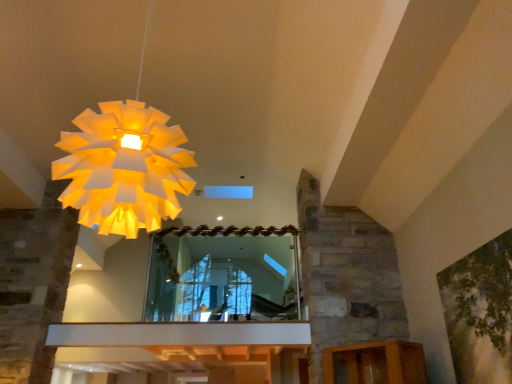
Identify the location of green leafy tree at upper right. Image resolution: width=512 pixels, height=384 pixels. (483, 291).

Where is `white paper lampshade at upper left`? This screenshot has width=512, height=384. white paper lampshade at upper left is located at coordinates tap(124, 165).

At what (x,y) coordinates should I click in order to perform the action: click on clear glass mirror at center. Please return your answer as a coordinate pair (x, y). This screenshot has height=384, width=512. Looking at the image, I should click on (223, 274).

Considering the sizes of white paper lampshade at upper left and clear glass mirror at center in the image, is white paper lampshade at upper left taller or shorter than clear glass mirror at center?

Clearly, white paper lampshade at upper left is taller compared to clear glass mirror at center.

Is white paper lampshade at upper left not near clear glass mirror at center?

Yes, white paper lampshade at upper left and clear glass mirror at center are quite far apart.

Can you tell me how much white paper lampshade at upper left and clear glass mirror at center differ in facing direction?

The facing directions of white paper lampshade at upper left and clear glass mirror at center are 0.0343 degrees apart.

From the image's perspective, does white paper lampshade at upper left appear lower than clear glass mirror at center?

Incorrect, from the image's perspective, white paper lampshade at upper left is higher than clear glass mirror at center.

Between green leafy tree at upper right and white paper lampshade at upper left, which one has larger width?

white paper lampshade at upper left is wider.

Can you confirm if green leafy tree at upper right is positioned to the left of white paper lampshade at upper left?

Incorrect, green leafy tree at upper right is not on the left side of white paper lampshade at upper left.

Could you tell me if green leafy tree at upper right is turned towards white paper lampshade at upper left?

No, green leafy tree at upper right does not turn towards white paper lampshade at upper left.

From a real-world perspective, does green leafy tree at upper right sit lower than white paper lampshade at upper left?

Yes, from a real-world perspective, green leafy tree at upper right is below white paper lampshade at upper left.

Does clear glass mirror at center lie in front of green leafy tree at upper right?

No.

How far apart are clear glass mirror at center and green leafy tree at upper right?

clear glass mirror at center is 2.79 meters from green leafy tree at upper right.

Find the location of a particular element. Image resolution: width=512 pixels, height=384 pixels. mirror below the green leafy tree at upper right (from the image's perspective) is located at coordinates (223, 274).

Is clear glass mirror at center inside the boundaries of green leafy tree at upper right, or outside?

clear glass mirror at center lies outside green leafy tree at upper right.

Is green leafy tree at upper right facing towards clear glass mirror at center?

No, green leafy tree at upper right is not turned towards clear glass mirror at center.

Does green leafy tree at upper right have a smaller size compared to clear glass mirror at center?

Correct, green leafy tree at upper right occupies less space than clear glass mirror at center.

Based on the photo, from a real-world perspective, which is physically above, green leafy tree at upper right or clear glass mirror at center?

clear glass mirror at center.

Looking at this image, which object is further away from the camera, clear glass mirror at center or white paper lampshade at upper left?

clear glass mirror at center.

Is clear glass mirror at center facing towards white paper lampshade at upper left?

No, clear glass mirror at center is not facing towards white paper lampshade at upper left.

Would you say clear glass mirror at center is to the left or to the right of white paper lampshade at upper left in the picture?

Based on their positions, clear glass mirror at center is located to the right of white paper lampshade at upper left.

Considering the sizes of objects white paper lampshade at upper left and green leafy tree at upper right in the image provided, who is shorter, white paper lampshade at upper left or green leafy tree at upper right?

With less height is green leafy tree at upper right.

Locate an element on the screen. tree to the right of white paper lampshade at upper left is located at coordinates (483, 291).

Is white paper lampshade at upper left at the right side of green leafy tree at upper right?

No.

Can we say white paper lampshade at upper left lies outside green leafy tree at upper right?

white paper lampshade at upper left is positioned outside green leafy tree at upper right.

At what (x,y) coordinates should I click in order to perform the action: click on lamp that is above the clear glass mirror at center (from a real-world perspective). Please return your answer as a coordinate pair (x, y). The height and width of the screenshot is (384, 512). Looking at the image, I should click on (124, 165).

This screenshot has height=384, width=512. I want to click on tree lying behind the white paper lampshade at upper left, so click(x=483, y=291).

Based on their spatial positions, is white paper lampshade at upper left or green leafy tree at upper right closer to clear glass mirror at center?

Based on the image, green leafy tree at upper right appears to be nearer to clear glass mirror at center.

When comparing their distances from green leafy tree at upper right, does clear glass mirror at center or white paper lampshade at upper left seem further?

Among the two, clear glass mirror at center is located further to green leafy tree at upper right.

Which object lies nearer to the anchor point white paper lampshade at upper left, clear glass mirror at center or green leafy tree at upper right?

Among the two, green leafy tree at upper right is located nearer to white paper lampshade at upper left.

Based on their spatial positions, is green leafy tree at upper right or white paper lampshade at upper left further from clear glass mirror at center?

white paper lampshade at upper left is further to clear glass mirror at center.

Consider the image. Looking at the image, which one is located further to green leafy tree at upper right, white paper lampshade at upper left or clear glass mirror at center?

clear glass mirror at center is positioned further to the anchor green leafy tree at upper right.

From the image, which object appears to be nearer to white paper lampshade at upper left, green leafy tree at upper right or clear glass mirror at center?

Among the two, green leafy tree at upper right is located nearer to white paper lampshade at upper left.

Identify the location of tree between white paper lampshade at upper left and clear glass mirror at center from front to back. The height and width of the screenshot is (384, 512). (483, 291).